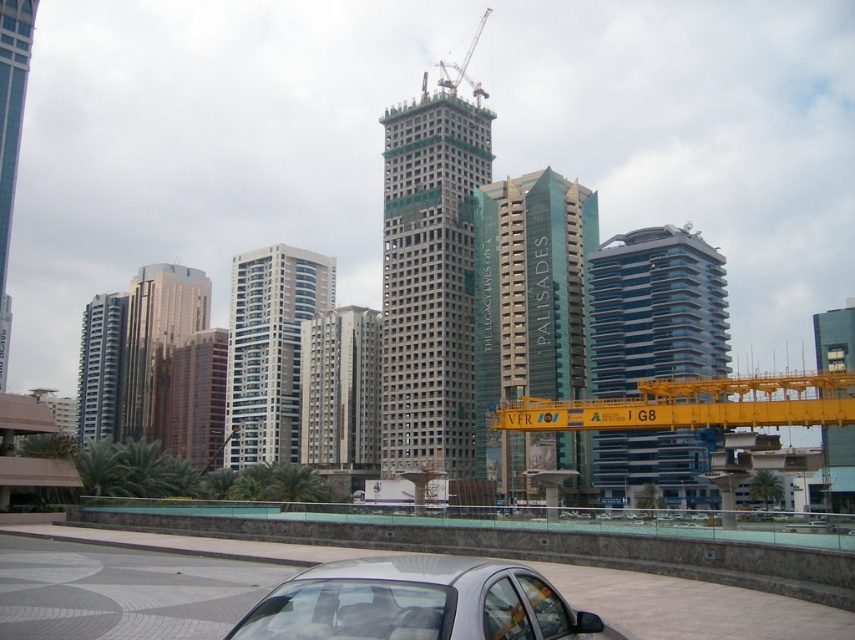
Can you confirm if sleek metallic car at lower center is positioned to the right of gray concrete building at center?

Yes, sleek metallic car at lower center is to the right of gray concrete building at center.

Can you confirm if sleek metallic car at lower center is taller than gray concrete building at center?

No, sleek metallic car at lower center is not taller than gray concrete building at center.

Does point (785, 570) come closer to viewer compared to point (305, 323)?

Yes, it is.

Identify the location of sleek metallic car at lower center. Image resolution: width=855 pixels, height=640 pixels. [x=559, y=570].

Which is above, shiny glass building at center or glassy steel skyscraper at left?

glassy steel skyscraper at left is higher up.

Which is more to the left, shiny glass building at center or glassy steel skyscraper at left?

glassy steel skyscraper at left is more to the left.

Is point (606, 250) positioned behind point (4, 362)?

No.

Where is `shiny glass building at center`? The height and width of the screenshot is (640, 855). shiny glass building at center is located at coordinates 655,308.

From the picture: Can you confirm if glossy glass building at center is positioned below transparent glass tower at right?

Incorrect, glossy glass building at center is not positioned below transparent glass tower at right.

Is glossy glass building at center behind transparent glass tower at right?

Yes.

The height and width of the screenshot is (640, 855). I want to click on glossy glass building at center, so click(x=158, y=342).